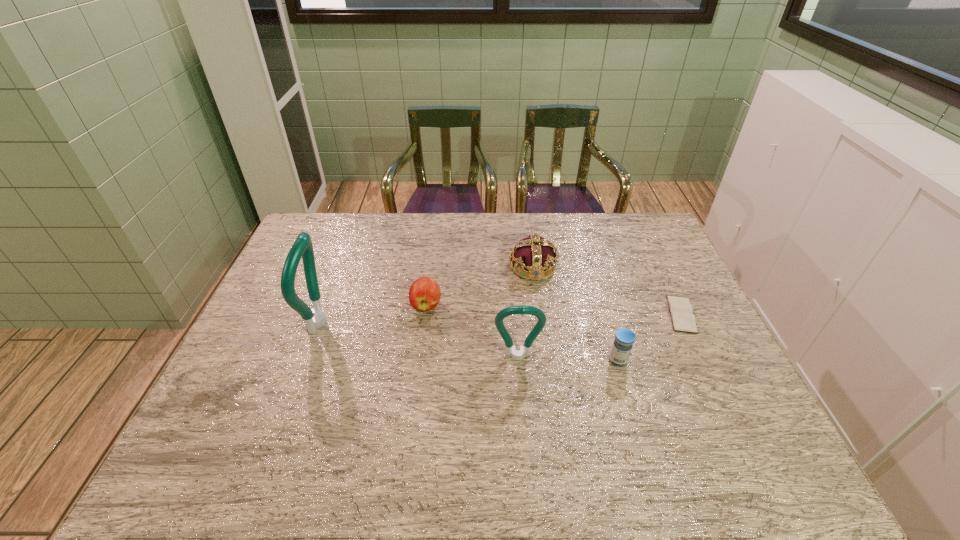
I want to click on the tallest object, so click(x=315, y=318).

What are the coordinates of `the farther bottle opener` in the screenshot? It's located at (315, 318).

Identify the location of the nearer bottle opener. (511, 351).

Locate an element on the screen. The height and width of the screenshot is (540, 960). the right bottle opener is located at coordinates (511, 351).

Image resolution: width=960 pixels, height=540 pixels. Identify the location of the shortest object. (681, 310).

Identify the location of diary. Image resolution: width=960 pixels, height=540 pixels. (681, 310).

I want to click on apple, so click(x=424, y=294).

What are the coordinates of `crown` in the screenshot? It's located at (534, 254).

I want to click on the farthest object, so click(x=534, y=254).

Where is `the second object from right to left`? the second object from right to left is located at coordinates (624, 338).